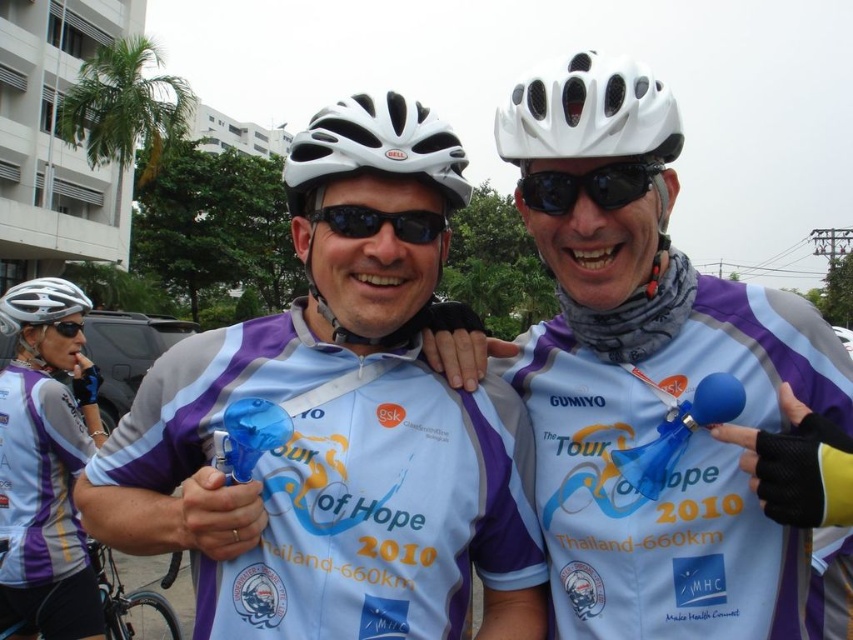
You are a photographer at a cycling event. You need to take a photo of the matte blue balloon at center and the black plastic goggles at center. Which object should you zoom in on to ensure both fit in the frame?

The matte blue balloon at center is larger than the black plastic goggles at center, so you should zoom in on the black plastic goggles at center to ensure both fit in the frame.

Looking at this image, you are a photographer taking a picture of two cyclists. You notice two points in the image at coordinates point (x=705, y=442) and point (x=363, y=228). Which point is closer to the camera?

Point (x=363, y=228) is closer to the camera because the other point is further away according to the description.

You are a photographer standing at the back of the scene. You want to take a closeup shot of the black rubber goggles at upper center. Based on the distance provided, do you need to adjust your camera lens to zoom in or zoom out to focus on the goggles?

The black rubber goggles at upper center are 9.30 feet away from the camera. To take a closeup shot, you would need to zoom in to focus on the goggles.